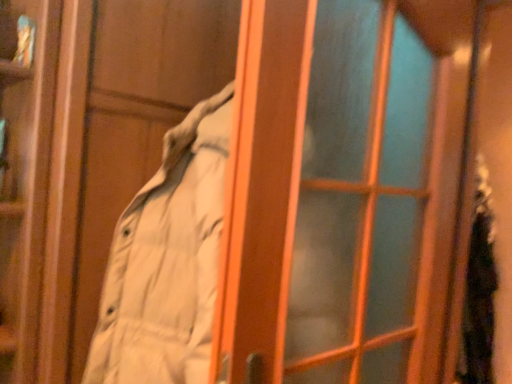
Question: From a real-world perspective, is fuzzy black scarf at right below translucent glass screen door at center?

Choices:
 (A) no
 (B) yes

Answer: (B)

Question: Could you tell me if fuzzy black scarf at right is facing translucent glass screen door at center?

Choices:
 (A) yes
 (B) no

Answer: (B)

Question: Is fuzzy black scarf at right directly adjacent to translucent glass screen door at center?

Choices:
 (A) no
 (B) yes

Answer: (A)

Question: Does fuzzy black scarf at right have a greater height compared to translucent glass screen door at center?

Choices:
 (A) no
 (B) yes

Answer: (B)

Question: Is fuzzy black scarf at right located outside translucent glass screen door at center?

Choices:
 (A) yes
 (B) no

Answer: (A)

Question: Is the depth of fuzzy black scarf at right less than that of translucent glass screen door at center?

Choices:
 (A) no
 (B) yes

Answer: (A)

Question: Is translucent glass screen door at center further to camera compared to fuzzy black scarf at right?

Choices:
 (A) yes
 (B) no

Answer: (B)

Question: Is translucent glass screen door at center positioned far away from fuzzy black scarf at right?

Choices:
 (A) yes
 (B) no

Answer: (A)

Question: Is translucent glass screen door at center thinner than fuzzy black scarf at right?

Choices:
 (A) yes
 (B) no

Answer: (A)

Question: From the image's perspective, is translucent glass screen door at center above fuzzy black scarf at right?

Choices:
 (A) no
 (B) yes

Answer: (B)

Question: Can you confirm if translucent glass screen door at center is taller than fuzzy black scarf at right?

Choices:
 (A) yes
 (B) no

Answer: (B)

Question: Is translucent glass screen door at center wider than fuzzy black scarf at right?

Choices:
 (A) no
 (B) yes

Answer: (A)

Question: Choose the correct answer: Is fuzzy black scarf at right inside translucent glass screen door at center or outside it?

Choices:
 (A) outside
 (B) inside

Answer: (A)